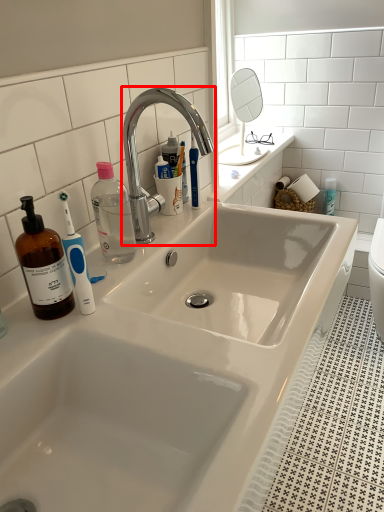
Question: From the image's perspective, what is the correct spatial positioning of tap (annotated by the red box) in reference to mirror?

Choices:
 (A) below
 (B) above

Answer: (A)